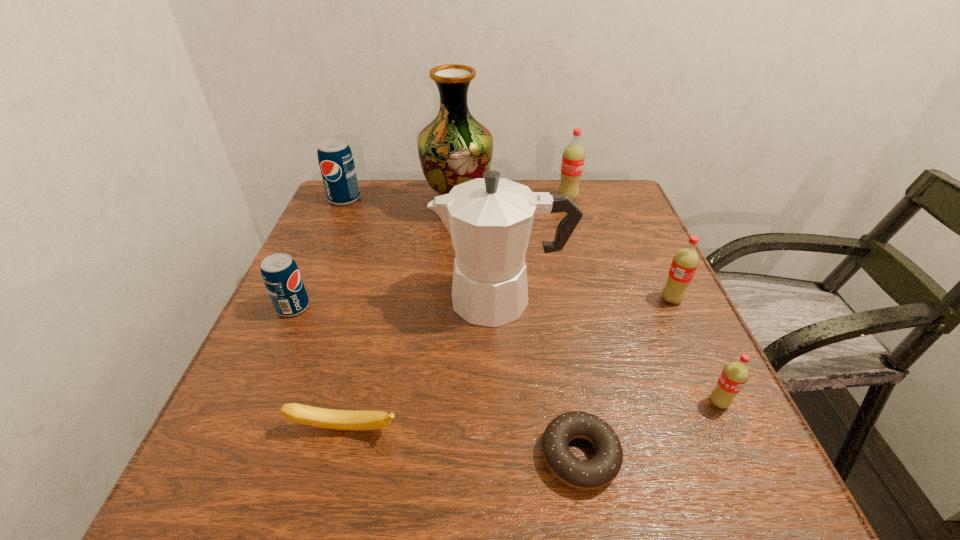
This screenshot has height=540, width=960. I want to click on the tallest object, so click(455, 148).

This screenshot has width=960, height=540. I want to click on coffeepot, so click(x=490, y=219).

At what (x,y) coordinates should I click in order to perform the action: click on the eighth shortest object. Please return your answer as a coordinate pair (x, y). Image resolution: width=960 pixels, height=540 pixels. Looking at the image, I should click on (490, 219).

In order to click on the biggest red soda in this screenshot , I will do `click(573, 157)`.

Where is `the leftmost red soda`? This screenshot has width=960, height=540. the leftmost red soda is located at coordinates (573, 157).

The width and height of the screenshot is (960, 540). Find the location of `the bigger blue pop`. the bigger blue pop is located at coordinates (335, 158).

I want to click on the second smallest red soda, so click(x=685, y=262).

The width and height of the screenshot is (960, 540). Find the location of `the smaller blue pop`. the smaller blue pop is located at coordinates (280, 273).

At what (x,y) coordinates should I click in order to perform the action: click on the seventh farthest object. Please return your answer as a coordinate pair (x, y). This screenshot has width=960, height=540. Looking at the image, I should click on (734, 376).

Where is `the smallest red soda`? The image size is (960, 540). the smallest red soda is located at coordinates (734, 376).